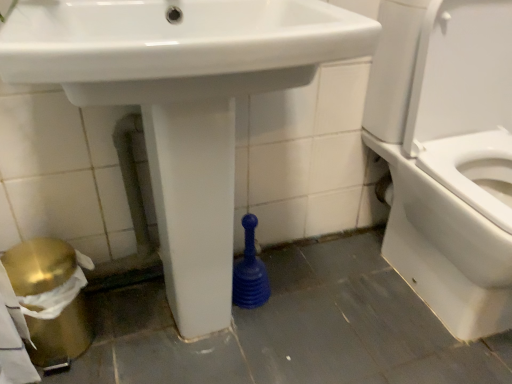
Question: Is white glossy sink at center not inside white glossy toilet at right?

Choices:
 (A) yes
 (B) no

Answer: (A)

Question: Could white glossy toilet at right be considered to be inside white glossy sink at center?

Choices:
 (A) no
 (B) yes

Answer: (A)

Question: From the image's perspective, is white glossy sink at center on white glossy toilet at right?

Choices:
 (A) no
 (B) yes

Answer: (A)

Question: Is the position of white glossy sink at center less distant than that of white glossy toilet at right?

Choices:
 (A) no
 (B) yes

Answer: (B)

Question: Is white glossy sink at center oriented towards white glossy toilet at right?

Choices:
 (A) yes
 (B) no

Answer: (B)

Question: Does white glossy sink at center have a lesser height compared to white glossy toilet at right?

Choices:
 (A) yes
 (B) no

Answer: (B)

Question: Is white glossy sink at center surrounded by white glossy toilet at right?

Choices:
 (A) no
 (B) yes

Answer: (A)

Question: Does white glossy toilet at right have a greater height compared to white glossy sink at center?

Choices:
 (A) yes
 (B) no

Answer: (B)

Question: Is white glossy toilet at right oriented away from white glossy sink at center?

Choices:
 (A) no
 (B) yes

Answer: (A)

Question: From a real-world perspective, is white glossy toilet at right on top of white glossy sink at center?

Choices:
 (A) yes
 (B) no

Answer: (B)

Question: Is white glossy toilet at right positioned far away from white glossy sink at center?

Choices:
 (A) no
 (B) yes

Answer: (A)

Question: From a real-world perspective, is white glossy toilet at right beneath white glossy sink at center?

Choices:
 (A) yes
 (B) no

Answer: (A)

Question: Is white glossy toilet at right taller or shorter than white glossy sink at center?

Choices:
 (A) tall
 (B) short

Answer: (B)